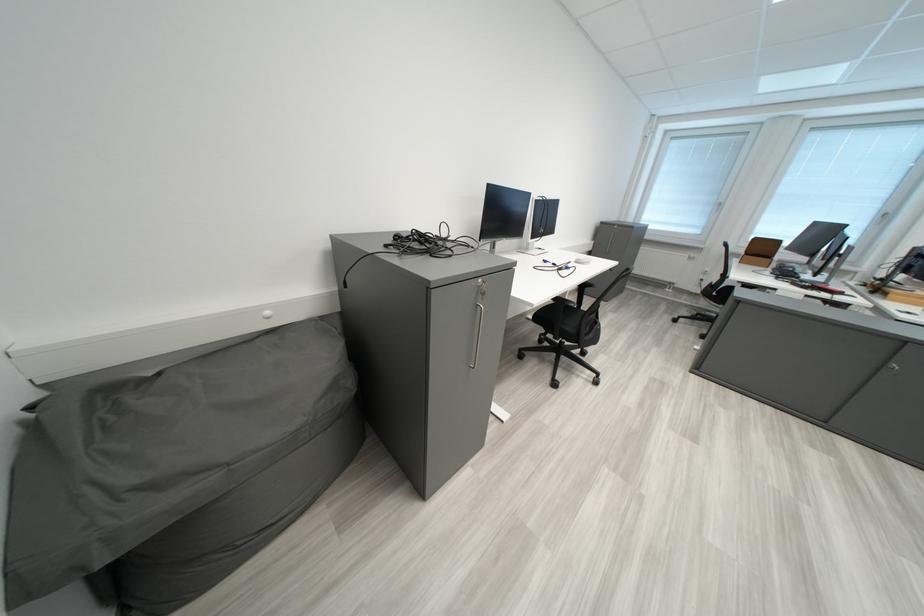
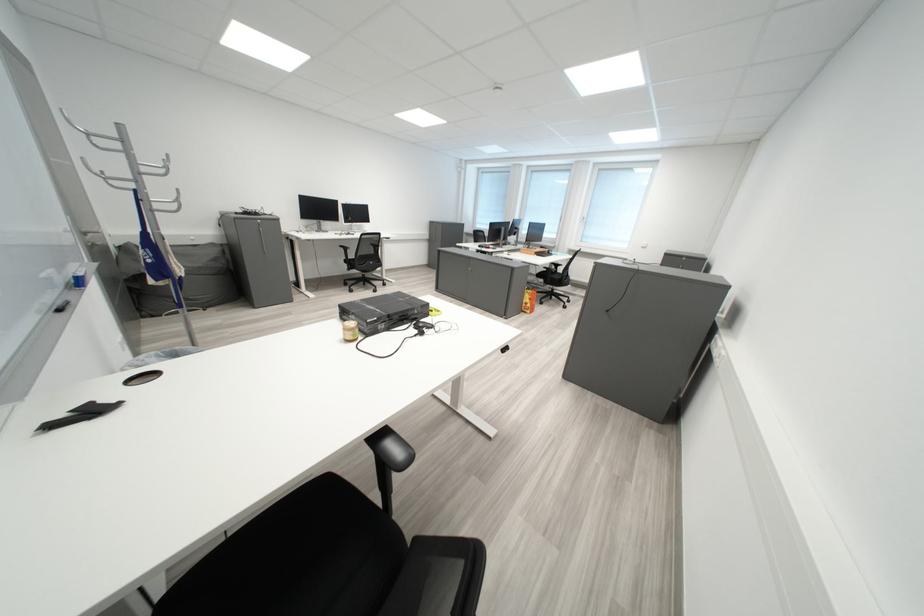
Looking at this image, what movement of the cameraman would produce the second image?

The movement direction of the cameraman is right, backward.